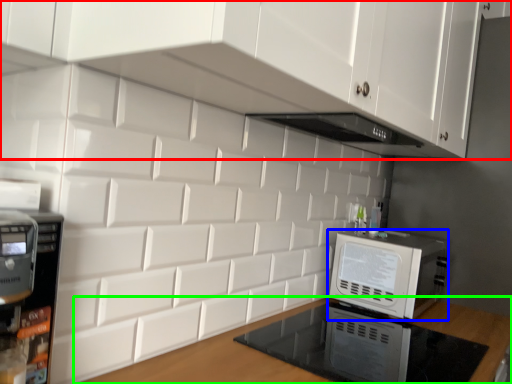
Question: Which object is positioned farthest from cabinetry (highlighted by a red box)? Select from home appliance (highlighted by a blue box) and countertop (highlighted by a green box).

Choices:
 (A) home appliance
 (B) countertop

Answer: (B)